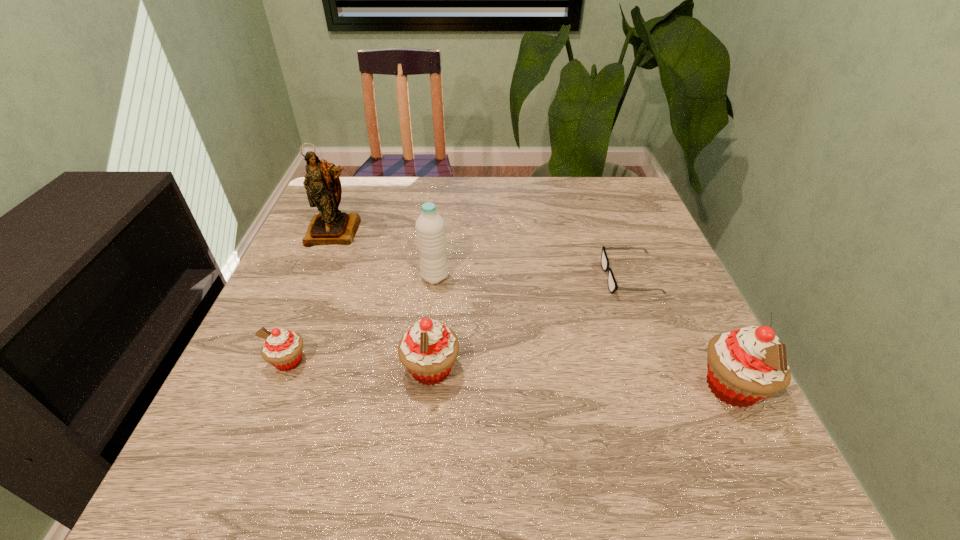
Please mark a free spot for a new cupcake to balance the arrangement. Please provide its 2D coordinates. Your answer should be formatted as a tuple, i.e. [(x, y)], where the tuple contains the x and y coordinates of a point satisfying the conditions above.

[(579, 378)]